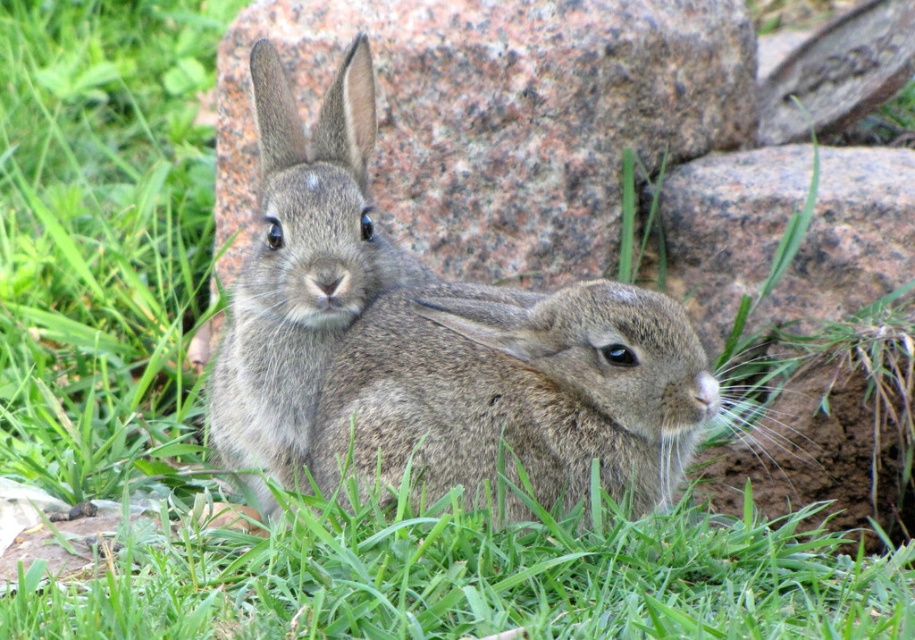
Consider the image. You are a photographer aiming to capture both the fuzzy brown rabbit at center and the fuzzy gray rabbit at center in a single shot. Based on their positions, which rabbit would appear closer to the camera?

The fuzzy brown rabbit at center is located below the fuzzy gray rabbit at center, so it would appear closer to the camera.

In the scene shown: You are a photographer trying to capture the two points in the image. The first point is at coordinates point [712,387] and the second is at point [249,456]. Which point is closer to the camera?

Point [712,387] is in front of point [249,456], so it is closer to the camera.